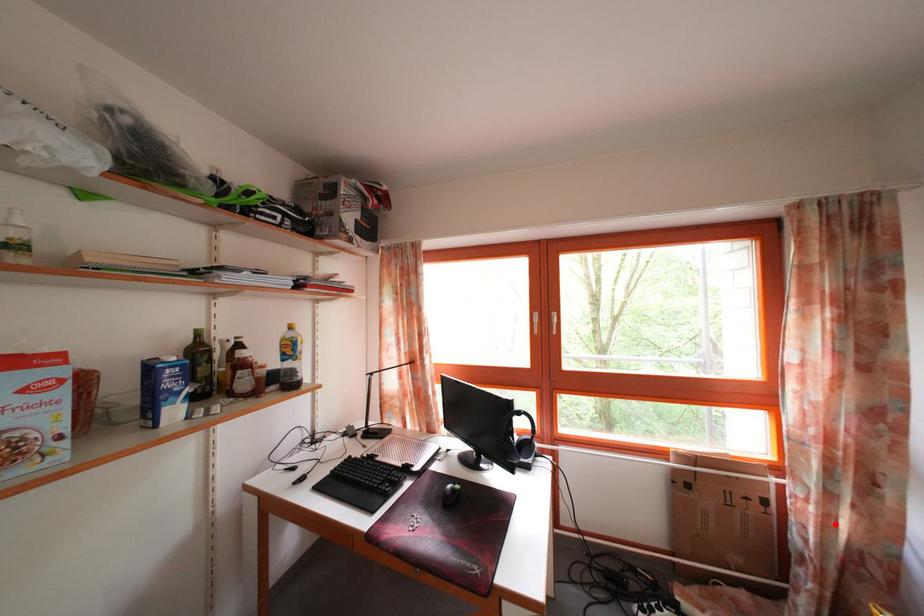
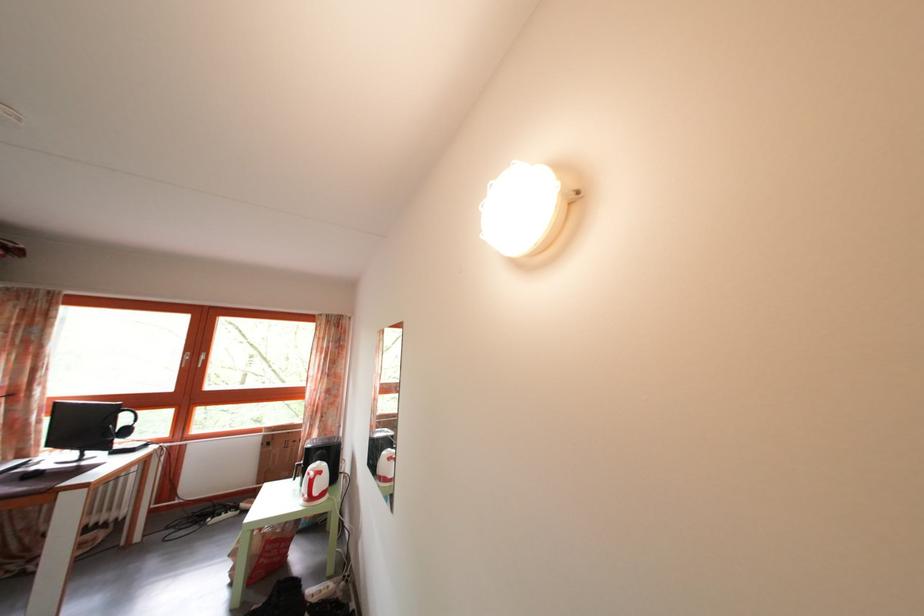
The point at the highlighted location is marked in the first image. Where is the corresponding point in the second image?

(317, 442)